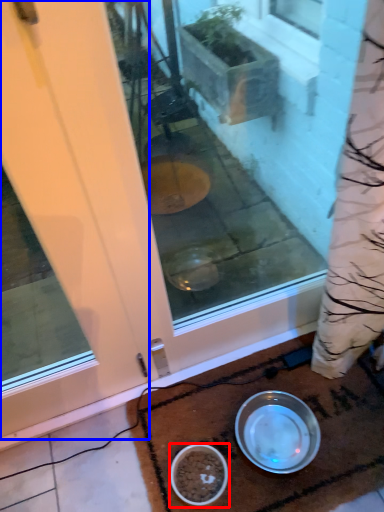
Question: Which of the following is the farthest to the observer, bowl (highlighted by a red box) or door (highlighted by a blue box)?

Choices:
 (A) bowl
 (B) door

Answer: (A)